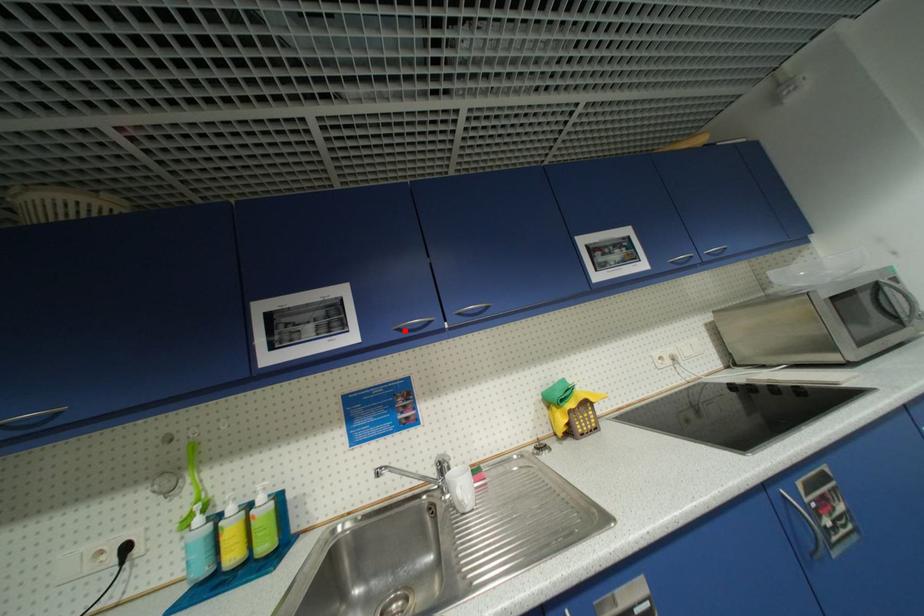
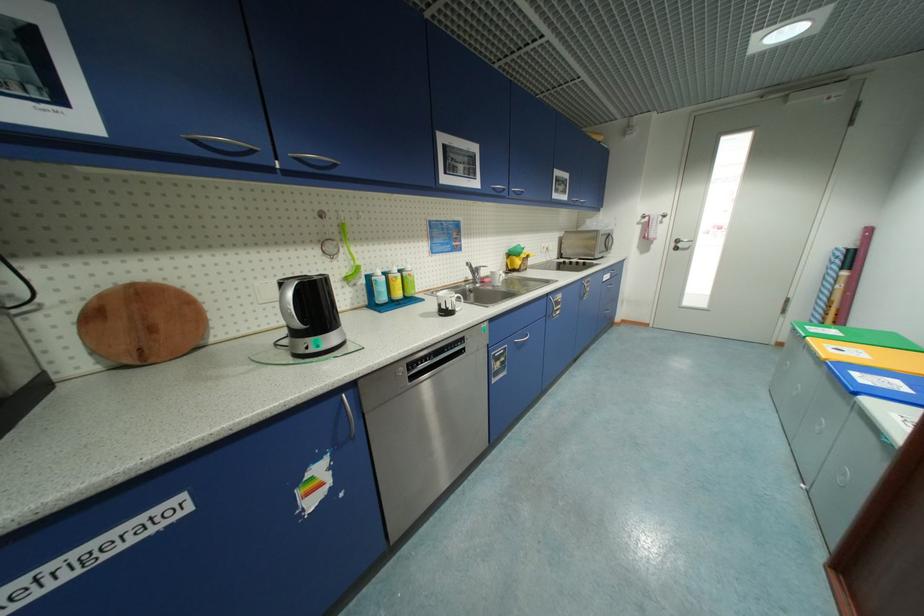
In the second image, find the point that corresponds to the highlighted location in the first image.

(499, 190)